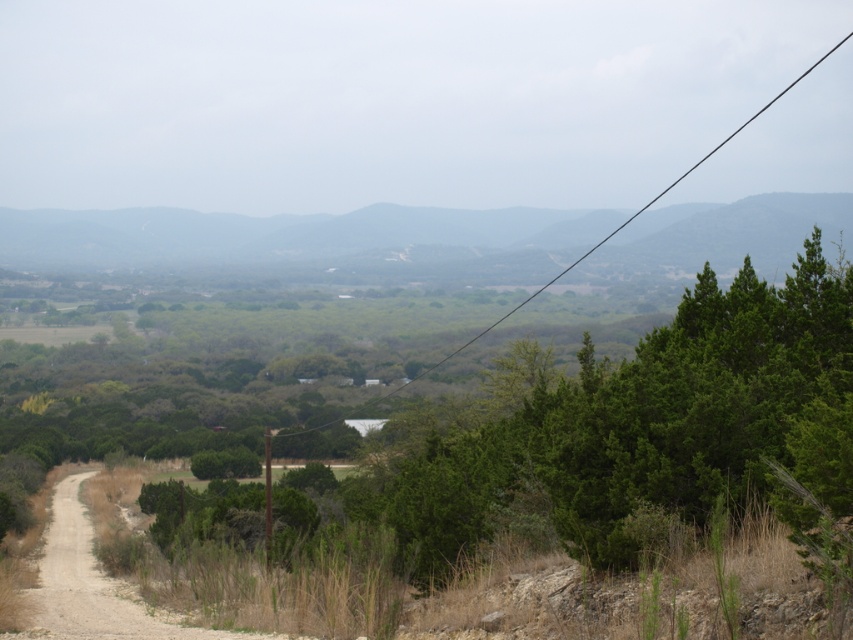
Question: Among these points, which one is farthest from the camera?

Choices:
 (A) (144, 260)
 (B) (741, 332)
 (C) (573, 262)

Answer: (A)

Question: Which object is positioned closest to the green grassy hill at center?

Choices:
 (A) green leafy tree at center
 (B) black wire at upper center

Answer: (B)

Question: Can you confirm if green grassy hill at center is positioned above black wire at upper center?

Choices:
 (A) no
 (B) yes

Answer: (A)

Question: Can you confirm if green leafy tree at center is bigger than black wire at upper center?

Choices:
 (A) yes
 (B) no

Answer: (B)

Question: Does green leafy tree at center have a lesser width compared to black wire at upper center?

Choices:
 (A) yes
 (B) no

Answer: (A)

Question: Which of the following is the farthest from the observer?

Choices:
 (A) (598, 426)
 (B) (622, 227)

Answer: (B)